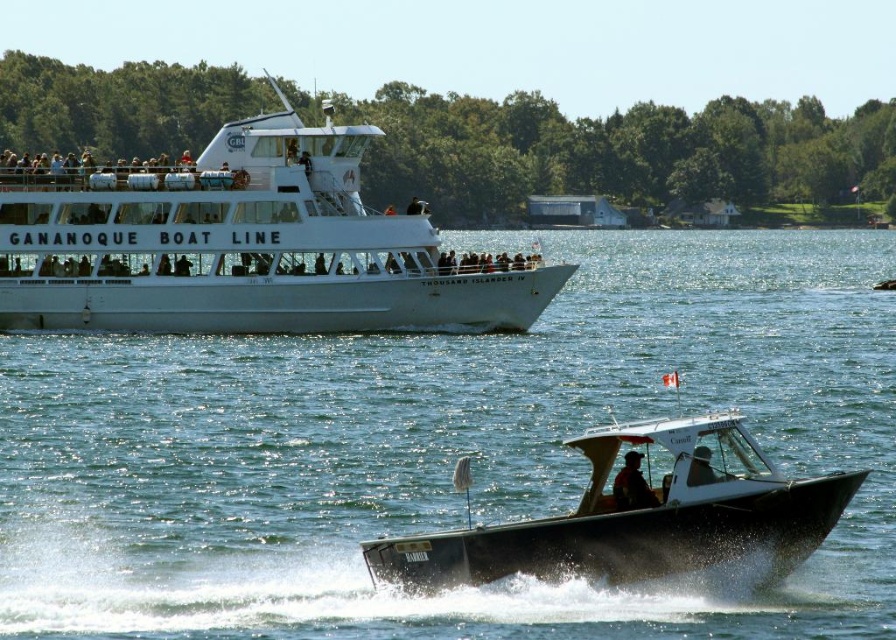
Question: Is clear blue water at center below white glossy boat at upper center?

Choices:
 (A) yes
 (B) no

Answer: (A)

Question: Does white glossy boat at upper center have a greater width compared to orange fabric jacket at lower center?

Choices:
 (A) yes
 (B) no

Answer: (A)

Question: Which of the following is the farthest from the observer?

Choices:
 (A) orange fabric jacket at lower center
 (B) white glossy boat at upper center

Answer: (B)

Question: Which point is closer to the camera?

Choices:
 (A) (204, 205)
 (B) (776, 577)
 (C) (640, 508)

Answer: (B)

Question: Among these points, which one is farthest from the camera?

Choices:
 (A) (617, 484)
 (B) (546, 595)
 (C) (627, 512)
 (D) (409, 260)

Answer: (D)

Question: From the image, what is the correct spatial relationship of clear blue water at center in relation to metallic gray boat at lower center?

Choices:
 (A) right
 (B) left

Answer: (A)